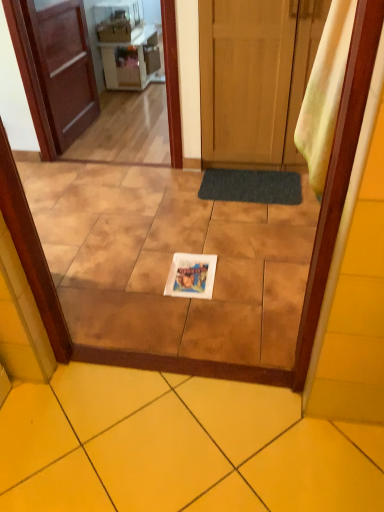
Question: Can you confirm if yellow fabric curtain at right is bigger than white glossy plate at center, positioned as the 1th ceramic tile in top-to-bottom order?

Choices:
 (A) no
 (B) yes

Answer: (A)

Question: Can you confirm if yellow fabric curtain at right is wider than white glossy plate at center, positioned as the 1th ceramic tile in top-to-bottom order?

Choices:
 (A) no
 (B) yes

Answer: (A)

Question: Is yellow fabric curtain at right further to the viewer compared to white glossy plate at center, positioned as the 1th ceramic tile in top-to-bottom order?

Choices:
 (A) yes
 (B) no

Answer: (B)

Question: Is yellow fabric curtain at right closer to camera compared to white glossy plate at center, the first ceramic tile when ordered from back to front?

Choices:
 (A) no
 (B) yes

Answer: (B)

Question: From a real-world perspective, is yellow fabric curtain at right located beneath white glossy plate at center, placed as the 2th ceramic tile when sorted from front to back?

Choices:
 (A) yes
 (B) no

Answer: (B)

Question: From the image's perspective, would you say yellow fabric curtain at right is positioned over white glossy plate at center, which is the 2th ceramic tile in bottom-to-top order?

Choices:
 (A) yes
 (B) no

Answer: (A)

Question: Is wooden door at center, which is the first door from right to left, placed right next to yellow fabric curtain at right?

Choices:
 (A) yes
 (B) no

Answer: (B)

Question: Is wooden door at center, the 2th door viewed from the left, located outside yellow fabric curtain at right?

Choices:
 (A) yes
 (B) no

Answer: (A)

Question: Is wooden door at center, the 2th door viewed from the left, behind yellow fabric curtain at right?

Choices:
 (A) no
 (B) yes

Answer: (B)

Question: Does wooden door at center, which is the first door from right to left, turn towards yellow fabric curtain at right?

Choices:
 (A) no
 (B) yes

Answer: (B)

Question: Is yellow fabric curtain at right located within wooden door at center, the 2th door viewed from the left?

Choices:
 (A) no
 (B) yes

Answer: (A)

Question: Does wooden door at center, which is the first door from right to left, have a greater height compared to yellow fabric curtain at right?

Choices:
 (A) no
 (B) yes

Answer: (B)

Question: Is wooden door at center, which is the first door from right to left, shorter than matte white microwave at upper center, which ranks as the 1th appliance in front-to-back order?

Choices:
 (A) yes
 (B) no

Answer: (B)